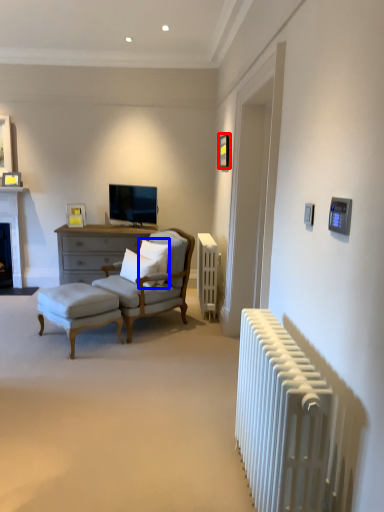
Question: Which object appears farthest to the camera in this image, picture frame (highlighted by a red box) or pillow (highlighted by a blue box)?

Choices:
 (A) picture frame
 (B) pillow

Answer: (A)